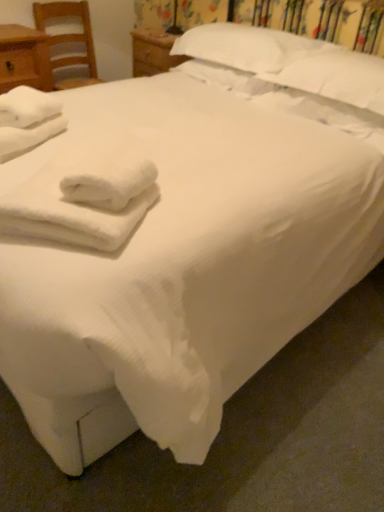
Question: Is matte wood nightstand at left facing towards white fluffy towels at lower left, which is the 1th bath towel from right to left?

Choices:
 (A) yes
 (B) no

Answer: (A)

Question: Is matte wood nightstand at left bigger than white fluffy towels at lower left, which is the 1th bath towel in front-to-back order?

Choices:
 (A) no
 (B) yes

Answer: (B)

Question: Considering the relative positions of matte wood nightstand at left and white fluffy towels at lower left, which is the 1th bath towel in front-to-back order, in the image provided, is matte wood nightstand at left behind white fluffy towels at lower left, which is the 1th bath towel in front-to-back order,?

Choices:
 (A) yes
 (B) no

Answer: (A)

Question: Considering the relative sizes of matte wood nightstand at left and white fluffy towels at lower left, which is the 1th bath towel in front-to-back order, in the image provided, is matte wood nightstand at left shorter than white fluffy towels at lower left, which is the 1th bath towel in front-to-back order,?

Choices:
 (A) no
 (B) yes

Answer: (A)

Question: Considering the relative sizes of matte wood nightstand at left and white fluffy towels at lower left, which is the 1th bath towel in front-to-back order, in the image provided, is matte wood nightstand at left thinner than white fluffy towels at lower left, which is the 1th bath towel in front-to-back order,?

Choices:
 (A) no
 (B) yes

Answer: (A)

Question: From the image's perspective, is matte wood nightstand at left located above white fluffy towels at lower left, the 2th bath towel when ordered from back to front?

Choices:
 (A) no
 (B) yes

Answer: (B)

Question: Can you confirm if white soft pillow at upper center, the 2th pillow positioned from the right, is wider than wooden chair at left?

Choices:
 (A) no
 (B) yes

Answer: (A)

Question: Does white soft pillow at upper center, the 2th pillow positioned from the right, appear on the right side of wooden chair at left?

Choices:
 (A) yes
 (B) no

Answer: (A)

Question: Can we say white soft pillow at upper center, the first pillow positioned from the left, lies outside wooden chair at left?

Choices:
 (A) no
 (B) yes

Answer: (B)

Question: Considering the relative sizes of white soft pillow at upper center, the 2th pillow positioned from the right, and wooden chair at left in the image provided, is white soft pillow at upper center, the 2th pillow positioned from the right, thinner than wooden chair at left?

Choices:
 (A) no
 (B) yes

Answer: (B)

Question: Does white soft pillow at upper center, the 2th pillow positioned from the right, have a greater height compared to wooden chair at left?

Choices:
 (A) yes
 (B) no

Answer: (B)

Question: Is matte wood nightstand at left not close to white soft towel at left, which appears as the second bath towel when viewed from the right?

Choices:
 (A) yes
 (B) no

Answer: (A)